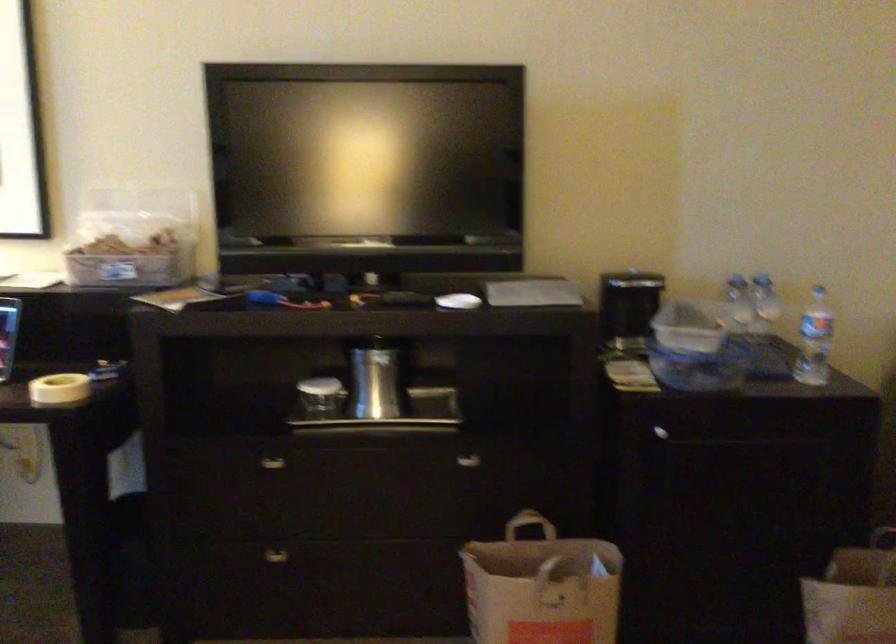
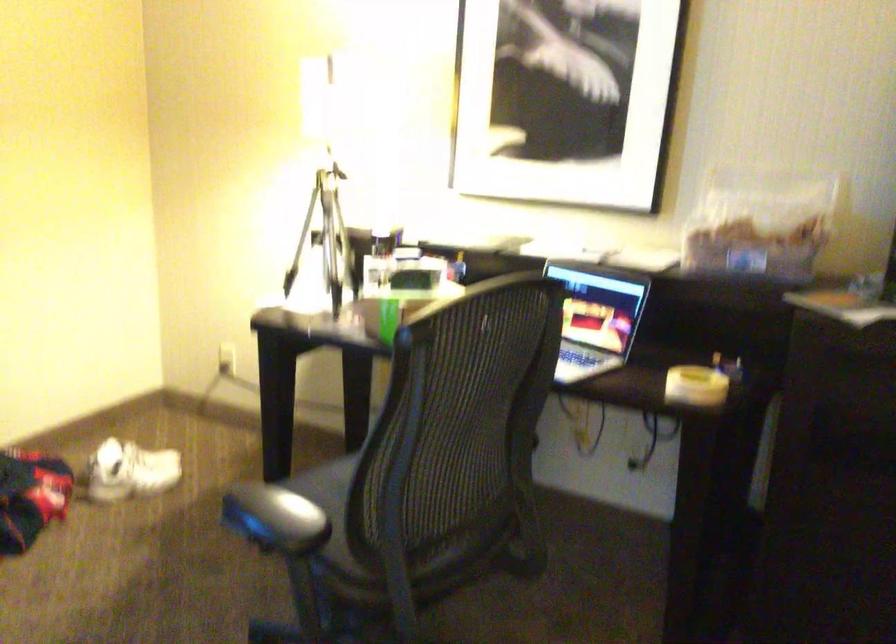
Question: How did the camera likely rotate?

Choices:
 (A) Left
 (B) Right
 (C) Up
 (D) Down

Answer: (A)